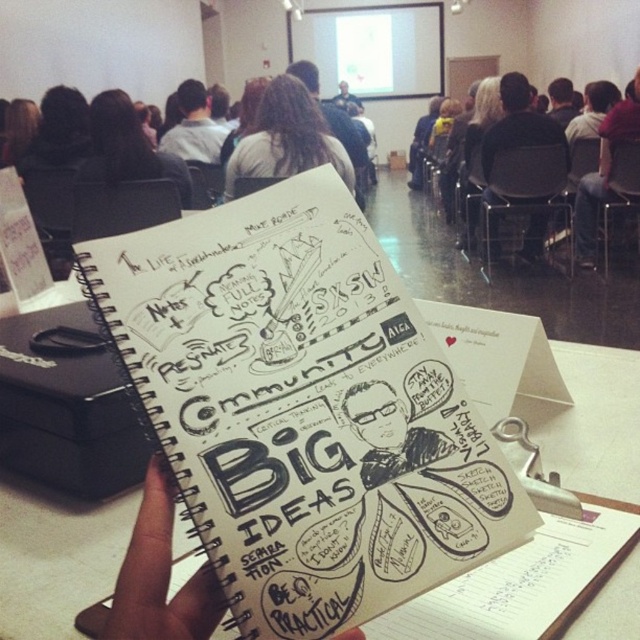
Can you confirm if dark hair at center is bigger than black textured sketchbook at center?

Yes, dark hair at center is bigger than black textured sketchbook at center.

Is point (538, 202) farther from viewer compared to point (444, 448)?

Yes, it is behind point (444, 448).

This screenshot has height=640, width=640. I want to click on dark hair at center, so [x=502, y=138].

Looking at this image, can you confirm if black paper at center is positioned to the right of black textured sketchbook at center?

Incorrect, black paper at center is not on the right side of black textured sketchbook at center.

Is point (125, 568) farther from viewer compared to point (349, 396)?

No.

Locate an element on the screen. black paper at center is located at coordinates (161, 576).

Is black skin at center behind black paper at center?

Yes, black skin at center is behind black paper at center.

Measure the distance between black skin at center and camera.

black skin at center is 11.65 inches from camera.

Image resolution: width=640 pixels, height=640 pixels. Describe the element at coordinates (161, 576) in the screenshot. I see `black skin at center` at that location.

Where is `black skin at center`? black skin at center is located at coordinates (161, 576).